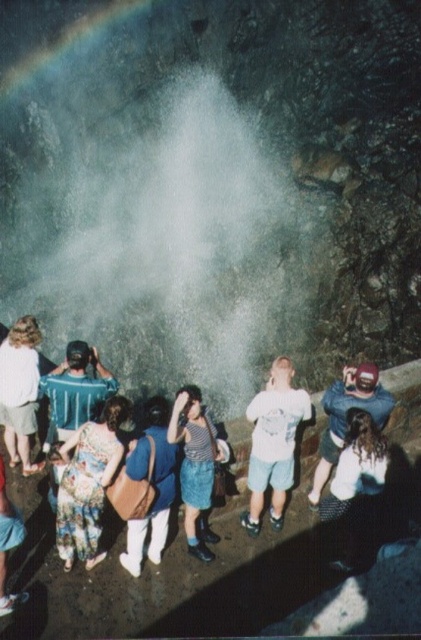
Question: Can you confirm if floral fabric dress at lower left is thinner than striped fabric shirt at center?

Choices:
 (A) no
 (B) yes

Answer: (A)

Question: Which of the following is the farthest from the observer?

Choices:
 (A) blue denim jeans at center
 (B) floral fabric dress at lower left
 (C) matte brown bag at center
 (D) striped fabric shirt at center

Answer: (D)

Question: Among these objects, which one is nearest to the camera?

Choices:
 (A) matte brown bag at center
 (B) striped fabric shirt at center
 (C) white cotton shirt at center

Answer: (A)

Question: Can you confirm if striped fabric shirt at center is positioned above blue denim jeans at center?

Choices:
 (A) yes
 (B) no

Answer: (B)

Question: Is white cotton shirt at center positioned at the back of blue denim jeans at center?

Choices:
 (A) no
 (B) yes

Answer: (B)

Question: Which point is closer to the camera?

Choices:
 (A) (255, 504)
 (B) (96, 515)

Answer: (B)